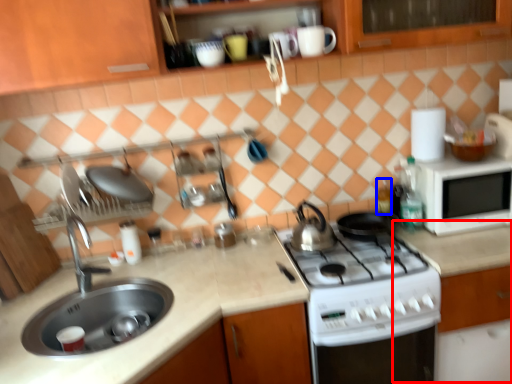
Question: Which of the following is the farthest to the observer, counter (highlighted by a red box) or bottle (highlighted by a blue box)?

Choices:
 (A) counter
 (B) bottle

Answer: (B)